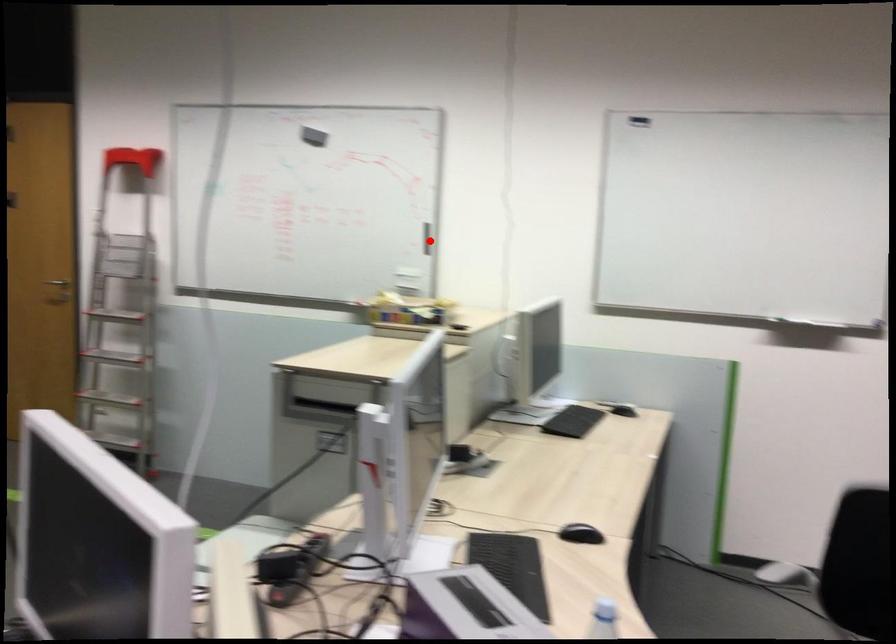
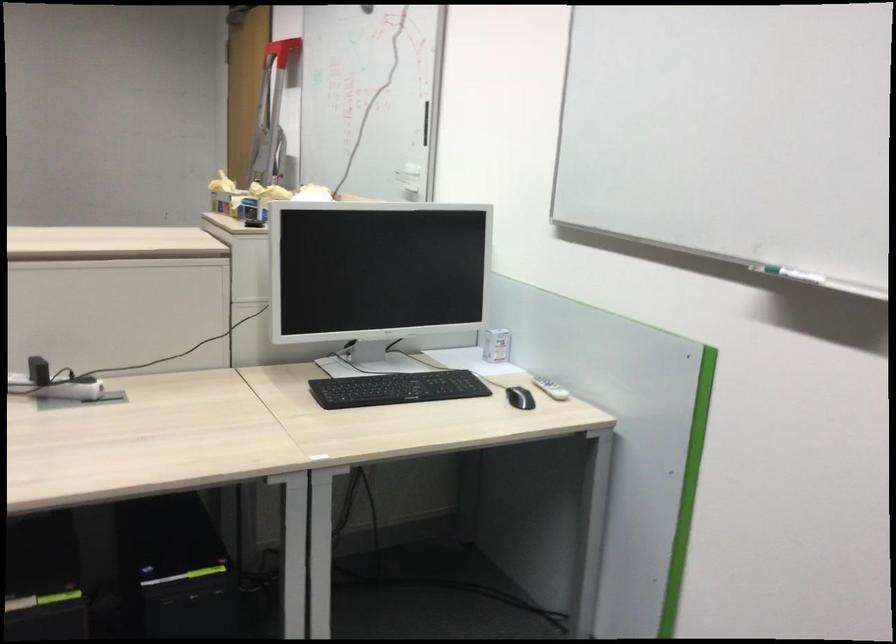
Find the pixel in the second image that matches the highlighted location in the first image.

(426, 122)